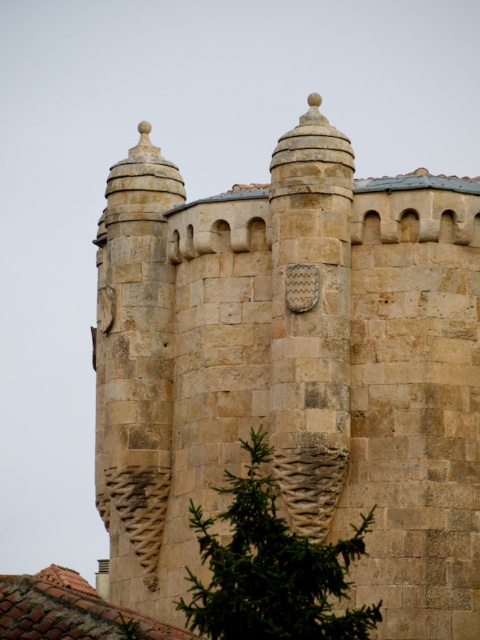
Is stone textured castle at center behind green textured stone at center?

Yes, it is behind green textured stone at center.

From the picture: Does stone textured castle at center appear on the right side of green textured stone at center?

Incorrect, stone textured castle at center is not on the right side of green textured stone at center.

Who is more distant from viewer, [240,189] or [289,548]?

The point [240,189] is behind.

The height and width of the screenshot is (640, 480). In order to click on stone textured castle at center in this screenshot , I will do `click(294, 369)`.